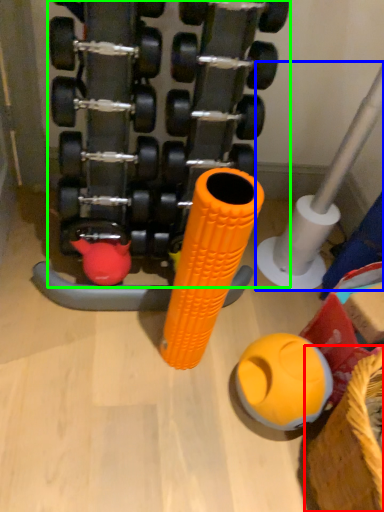
Question: Considering the real-world distances, which object is farthest from basket (highlighted by a red box)? pipe (highlighted by a blue box) or dumbbell (highlighted by a green box)?

Choices:
 (A) pipe
 (B) dumbbell

Answer: (B)